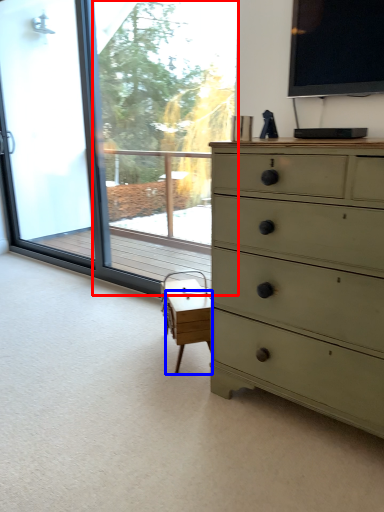
Question: Among these objects, which one is nearest to the camera, window screen (highlighted by a red box) or table (highlighted by a blue box)?

Choices:
 (A) window screen
 (B) table

Answer: (B)